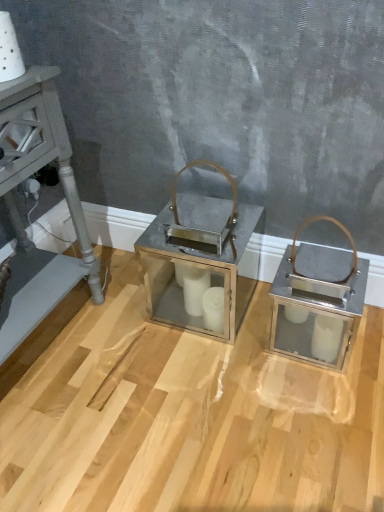
The height and width of the screenshot is (512, 384). I want to click on space that is in front of metallic silver lantern at center, so click(x=197, y=376).